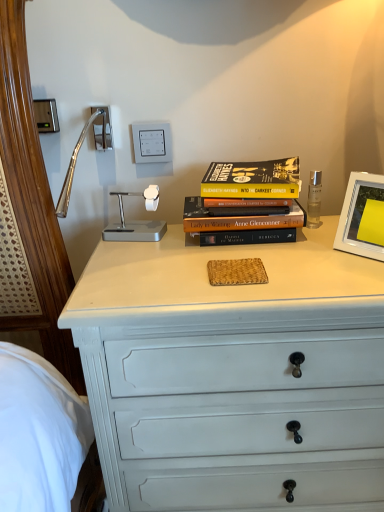
Where is `vacant area that lies between hardcover book at center and white plastic picture frame at upper right`? This screenshot has height=512, width=384. vacant area that lies between hardcover book at center and white plastic picture frame at upper right is located at coordinates (304, 248).